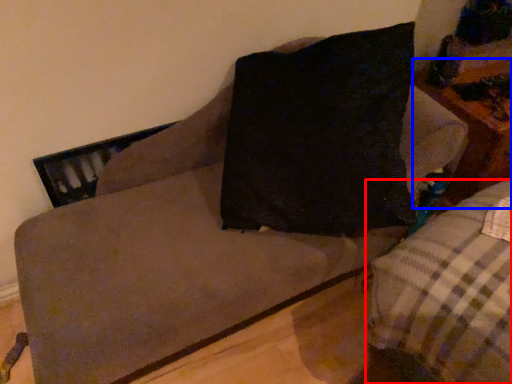
Question: Which object is further to the camera taking this photo, studio couch (highlighted by a red box) or table (highlighted by a blue box)?

Choices:
 (A) studio couch
 (B) table

Answer: (B)